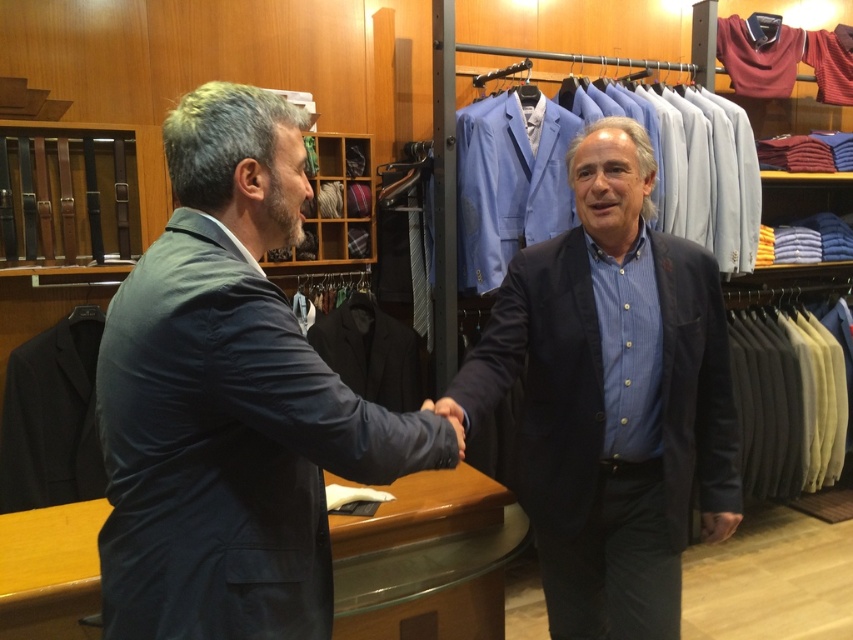
Who is more distant from viewer, [619,404] or [460,442]?

The point [619,404] is more distant.

Which is in front, point (662, 392) or point (454, 403)?

Point (454, 403) is in front.

Identify the location of matte black blazer at center. (612, 397).

Is point (129, 486) less distant than point (440, 406)?

Yes, it is.

Does dark blue suit at left have a greater height compared to matte black hand at center?

Correct, dark blue suit at left is much taller as matte black hand at center.

What do you see at coordinates (229, 400) in the screenshot? I see `dark blue suit at left` at bounding box center [229, 400].

What are the coordinates of `dark blue suit at left` in the screenshot? It's located at (229, 400).

Does dark blue suit at left lie in front of matte black blazer at center?

Yes, dark blue suit at left is in front of matte black blazer at center.

Locate an element on the screen. This screenshot has width=853, height=640. dark blue suit at left is located at coordinates (229, 400).